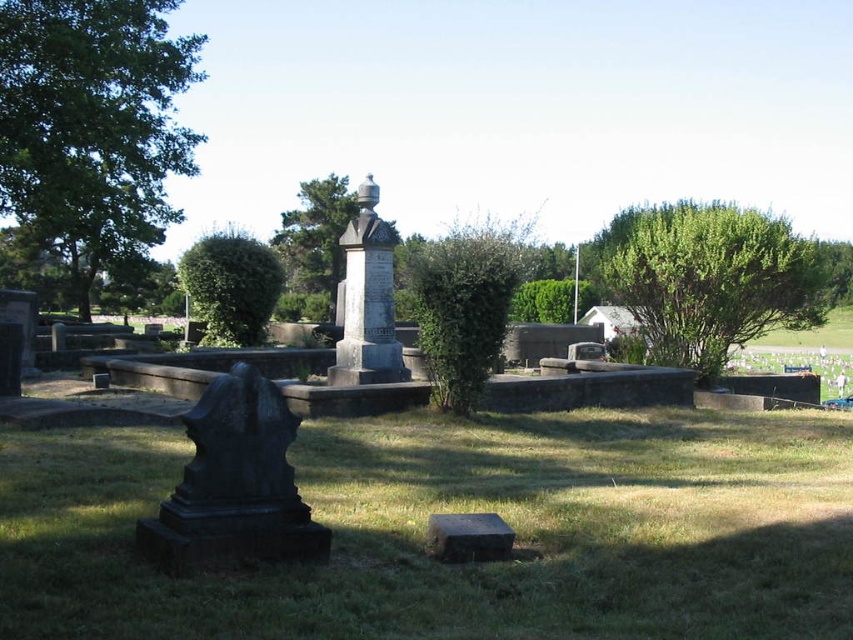
Who is lower down, granite gravestone at center or green leafy hedge at center?

Positioned lower is granite gravestone at center.

Is granite gravestone at center positioned behind green leafy hedge at center?

Yes, granite gravestone at center is further from the viewer.

Does point (392, 244) come closer to viewer compared to point (547, 278)?

Yes.

Where is `granite gravestone at center`? This screenshot has width=853, height=640. granite gravestone at center is located at coordinates pyautogui.click(x=367, y=300).

Is black granite gravestone at lower center thinner than green leafy hedge at center?

Yes.

Between point (456, 554) and point (583, 291), which one is positioned in front?

Point (456, 554) is more forward.

Identify the location of black granite gravestone at lower center. (468, 536).

Does green leafy tree at upper left appear on the left side of granite gravestone at center?

Indeed, green leafy tree at upper left is positioned on the left side of granite gravestone at center.

Does point (103, 188) come behind point (370, 202)?

That is True.

Is point (55, 13) positioned before point (370, 280)?

No, it is not.

This screenshot has height=640, width=853. I want to click on green leafy tree at upper left, so click(91, 125).